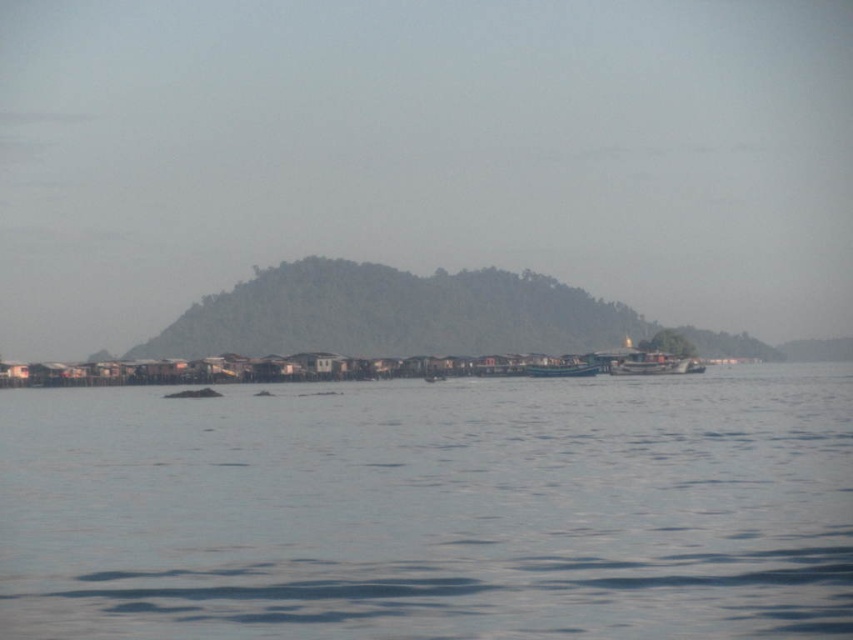
You are standing on the shore looking out at the cluster of stilt houses and the water. There is a point marked at coordinates (433, 509). What does this point represent?

The point at coordinates (433, 509) represents clear blue water at center.

You are standing on the wooden boat at center and want to look towards the direction where the clear blue water at center is located. Which direction should you face?

You should face to the left because the clear blue water at center is located to the left of the wooden boat at center.